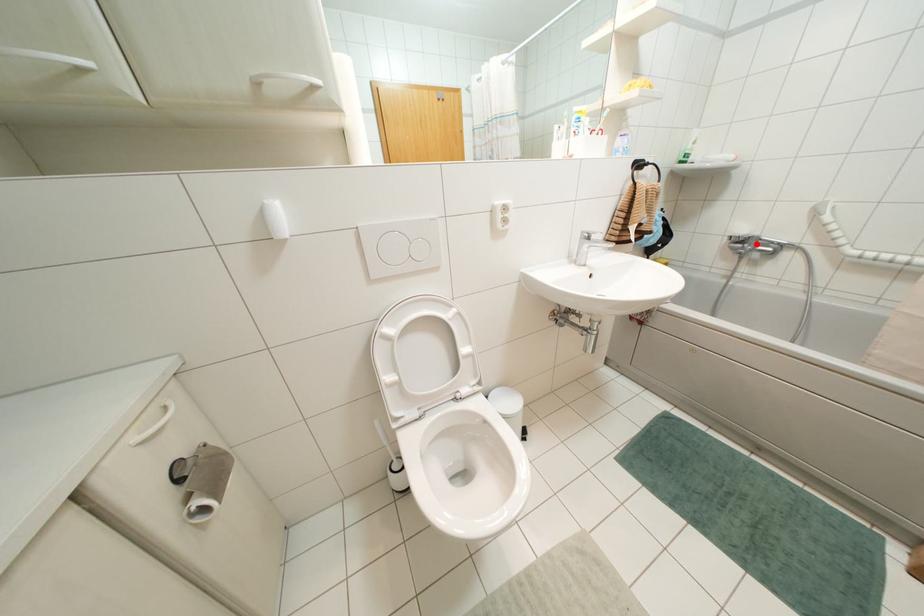
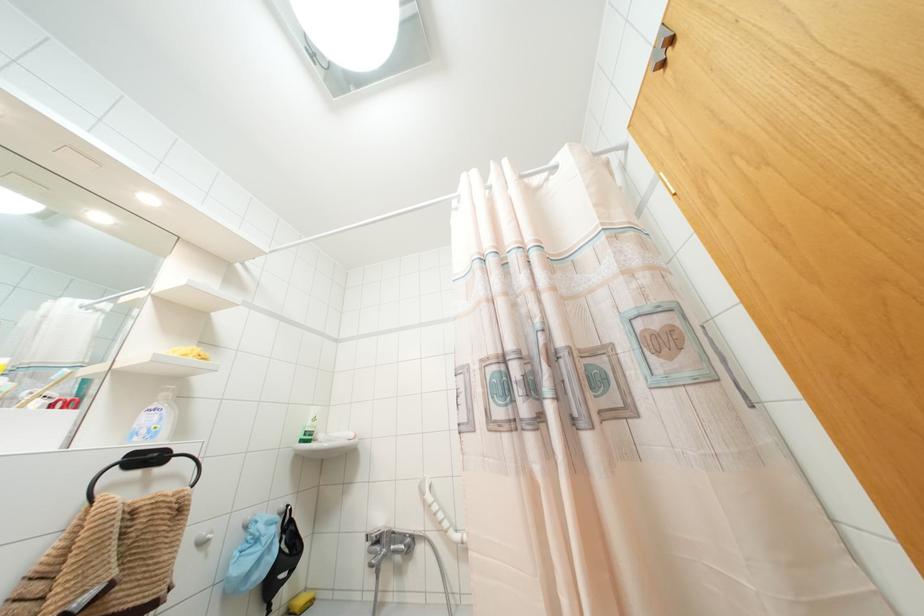
Find the pixel in the second image that matches the highlighted location in the first image.

(390, 541)